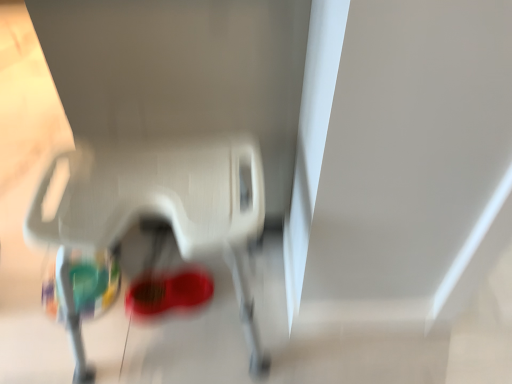
Question: Considering the positions of point (252, 182) and point (188, 296), is point (252, 182) closer or farther from the camera than point (188, 296)?

Choices:
 (A) closer
 (B) farther

Answer: (A)

Question: In the image, is white plastic baby carriage at lower center positioned in front of or behind shiny red shoe at center?

Choices:
 (A) behind
 (B) front

Answer: (B)

Question: Is white plastic baby carriage at lower center taller or shorter than shiny red shoe at center?

Choices:
 (A) tall
 (B) short

Answer: (A)

Question: Relative to white plastic baby carriage at lower center, is shiny red shoe at center in front or behind?

Choices:
 (A) front
 (B) behind

Answer: (B)

Question: Does point (193, 304) appear closer or farther from the camera than point (70, 311)?

Choices:
 (A) farther
 (B) closer

Answer: (A)

Question: In terms of width, does shiny red shoe at center look wider or thinner when compared to white plastic baby carriage at lower center?

Choices:
 (A) thin
 (B) wide

Answer: (A)

Question: Which is correct: shiny red shoe at center is inside white plastic baby carriage at lower center, or outside of it?

Choices:
 (A) outside
 (B) inside

Answer: (B)